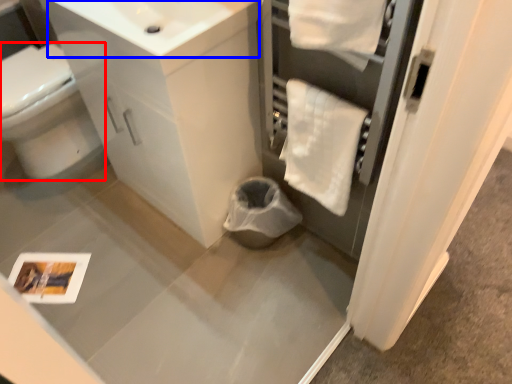
Question: Which object appears closest to the camera in this image, bidet (highlighted by a red box) or sink (highlighted by a blue box)?

Choices:
 (A) bidet
 (B) sink

Answer: (B)